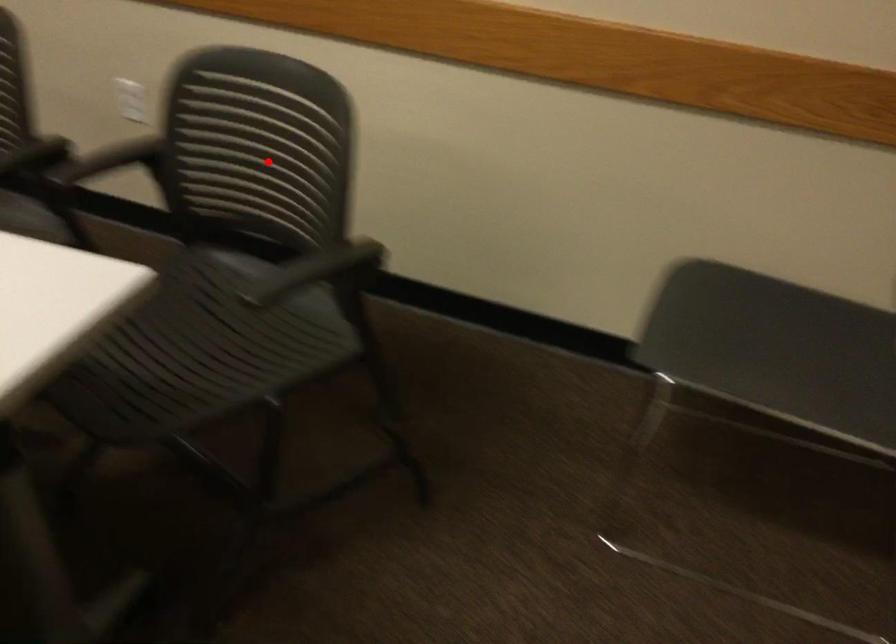
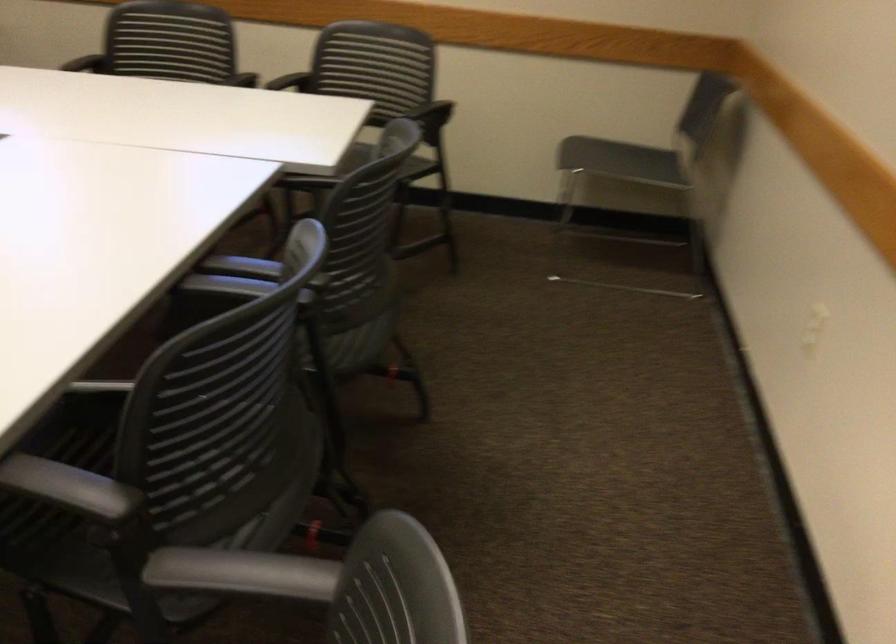
Where in the second image is the point corresponding to the highlighted location from the first image?

(375, 73)